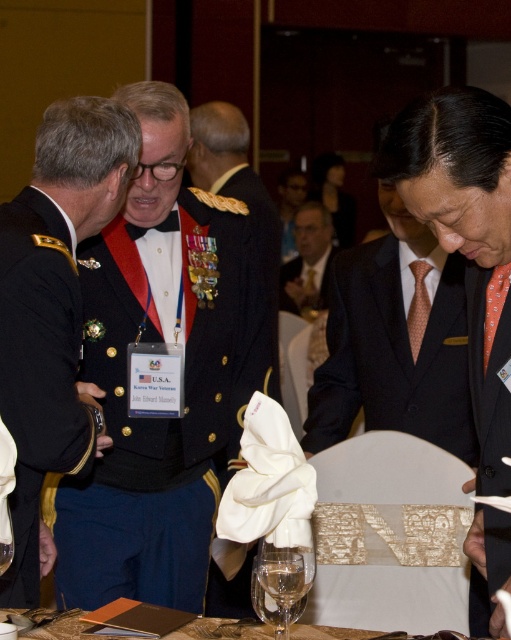
You are attending this formal event and notice two items of interest. The orange dotted tie at right and the translucent glass wine at center. Which of these items has a smaller width?

The orange dotted tie at right is thinner than the translucent glass wine at center, so the orange dotted tie at right has a smaller width.